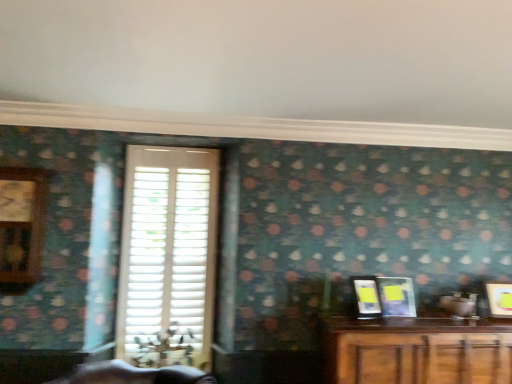
Question: Is metallic silver picture frame at right, which is counted as the second picture frame, starting from the right, to the left or to the right of wooden clock at left in the image?

Choices:
 (A) right
 (B) left

Answer: (A)

Question: Considering the positions of point (410, 311) and point (10, 264), is point (410, 311) closer or farther from the camera than point (10, 264)?

Choices:
 (A) closer
 (B) farther

Answer: (B)

Question: Which of these objects is positioned farthest from the matte black picture frame at right, which is counted as the 3th picture frame, starting from the right?

Choices:
 (A) wooden clock at left
 (B) matte yellow picture frame at right, which ranks as the 3th picture frame in left-to-right order
 (C) metallic silver picture frame at right, the second picture frame in the left-to-right sequence
 (D) white matte shutters at center

Answer: (A)

Question: Which object is the farthest from the wooden clock at left?

Choices:
 (A) metallic silver picture frame at right, the second picture frame in the left-to-right sequence
 (B) matte yellow picture frame at right, marked as the 1th picture frame in a right-to-left arrangement
 (C) matte black picture frame at right, which is counted as the 3th picture frame, starting from the right
 (D) white matte shutters at center

Answer: (B)